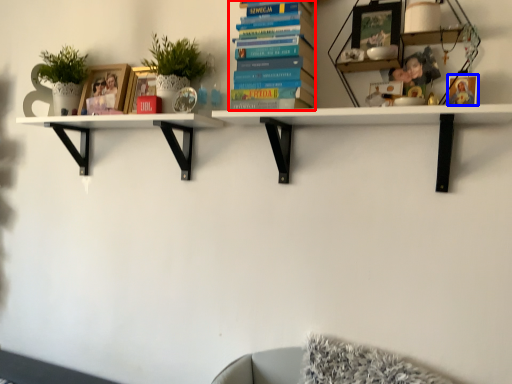
Question: Which object is closer to the camera taking this photo, book (highlighted by a red box) or picture frame (highlighted by a blue box)?

Choices:
 (A) book
 (B) picture frame

Answer: (B)